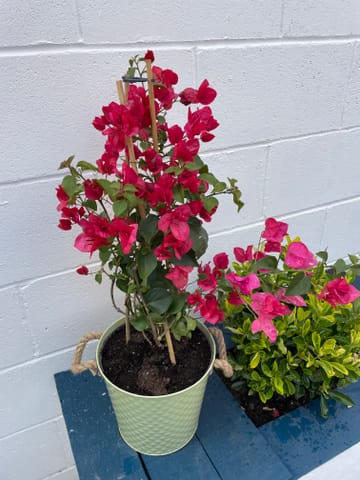
The width and height of the screenshot is (360, 480). What are the coordinates of `dark blue painted wooden flower box` in the screenshot? It's located at (250, 439).